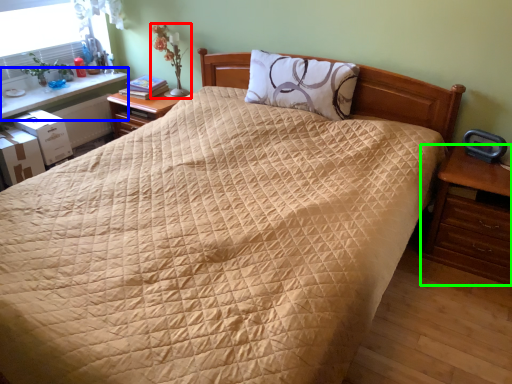
Question: Based on their relative distances, which object is farther from table lamp (highlighted by a red box)? Choose from table (highlighted by a blue box) and nightstand (highlighted by a green box).

Choices:
 (A) table
 (B) nightstand

Answer: (B)